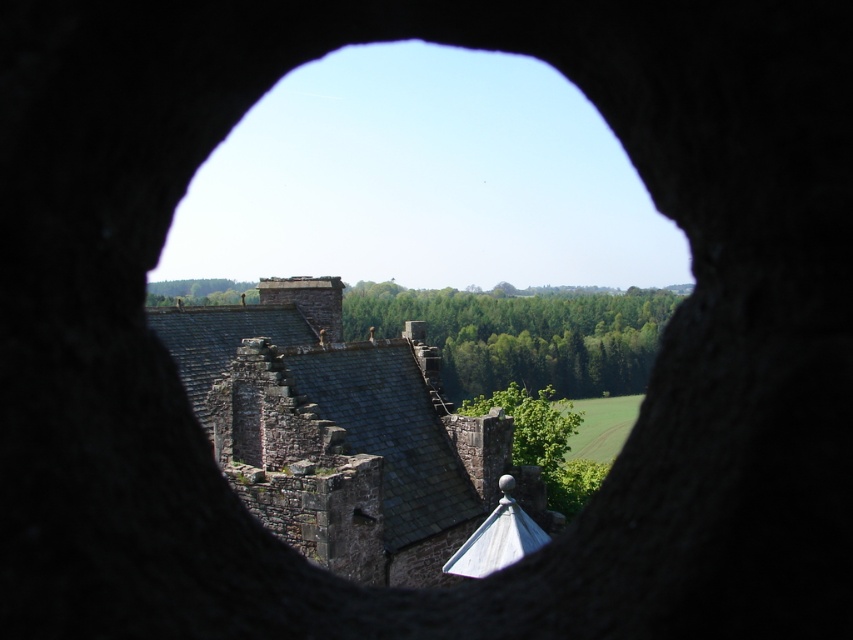
Is point (318, 376) positioned after point (538, 412)?

No, it is not.

The image size is (853, 640). In order to click on smooth stone window at center in this screenshot , I will do `click(341, 432)`.

Is green leafy trees at center below green leafy tree at center?

Actually, green leafy trees at center is above green leafy tree at center.

Does point (602, 356) lie in front of point (561, 406)?

No.

Find the location of a particular element. Image resolution: width=853 pixels, height=640 pixels. green leafy trees at center is located at coordinates (521, 336).

Does smooth stone window at center have a greater width compared to dark gray stone castle at center?

Correct, the width of smooth stone window at center exceeds that of dark gray stone castle at center.

Does smooth stone window at center appear over dark gray stone castle at center?

Yes.

Locate an element on the screen. smooth stone window at center is located at coordinates (341, 432).

Image resolution: width=853 pixels, height=640 pixels. I want to click on smooth stone window at center, so click(341, 432).